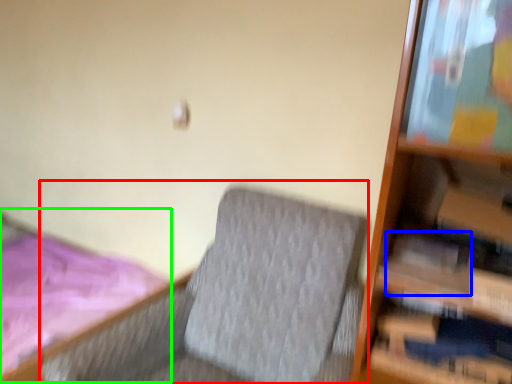
Question: Estimate the real-world distances between objects in this image. Which object is farther from rocking chair (highlighted by a red box), paperback book (highlighted by a blue box) or bed (highlighted by a green box)?

Choices:
 (A) paperback book
 (B) bed

Answer: (B)